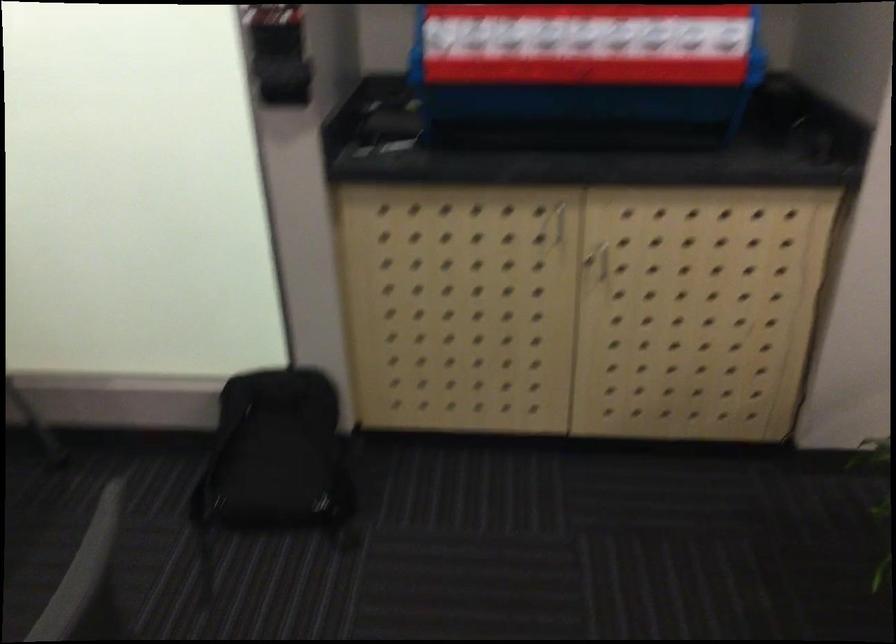
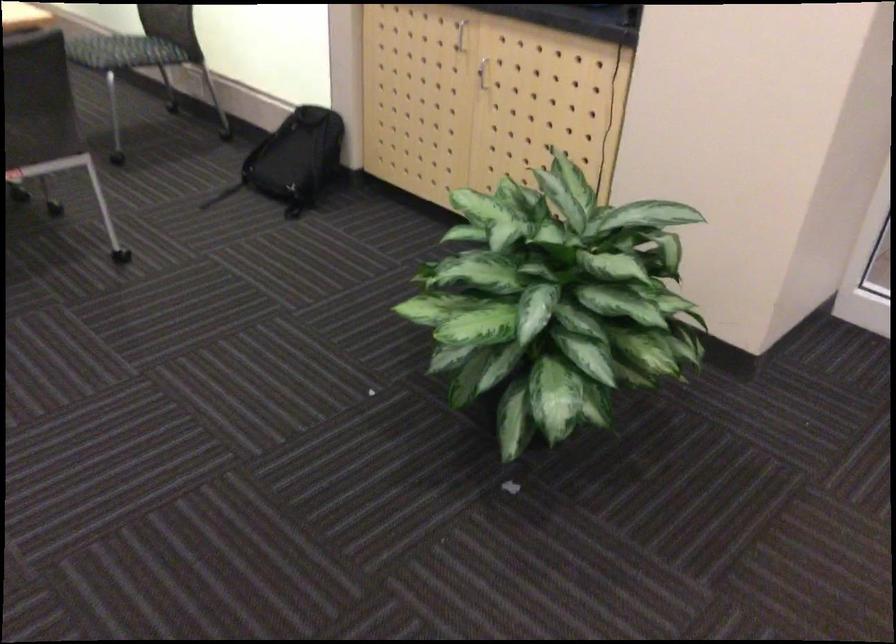
Where in the second image is the point corresponding to pixel 304 460 from the first image?

(293, 160)